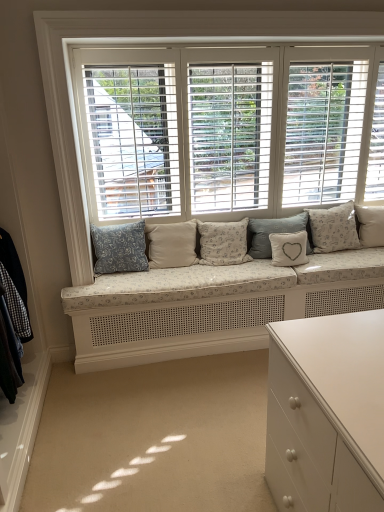
Question: Does white textured cushion at center, the 2th pillow positioned from the right, come in front of white textured pillow at right, which appears as the first pillow when viewed from the right?

Choices:
 (A) no
 (B) yes

Answer: (B)

Question: Does white textured cushion at center, arranged as the sixth pillow when viewed from the left, have a greater width compared to white textured pillow at right, which appears as the first pillow when viewed from the right?

Choices:
 (A) no
 (B) yes

Answer: (B)

Question: Could you tell me if white textured cushion at center, the 2th pillow positioned from the right, is turned towards white textured pillow at right, placed as the seventh pillow when sorted from left to right?

Choices:
 (A) yes
 (B) no

Answer: (B)

Question: Is white textured cushion at center, the 2th pillow positioned from the right, facing away from white textured pillow at right, placed as the seventh pillow when sorted from left to right?

Choices:
 (A) yes
 (B) no

Answer: (B)

Question: Does white textured cushion at center, arranged as the sixth pillow when viewed from the left, have a greater height compared to white textured pillow at right, placed as the seventh pillow when sorted from left to right?

Choices:
 (A) yes
 (B) no

Answer: (A)

Question: Can you see white textured cushion at center, the 2th pillow positioned from the right, touching white textured pillow at right, placed as the seventh pillow when sorted from left to right?

Choices:
 (A) no
 (B) yes

Answer: (A)

Question: Considering the relative sizes of white textured pillow at center, the 5th pillow when ordered from left to right, and white textured pillow at right, placed as the seventh pillow when sorted from left to right, in the image provided, is white textured pillow at center, the 5th pillow when ordered from left to right, shorter than white textured pillow at right, placed as the seventh pillow when sorted from left to right,?

Choices:
 (A) yes
 (B) no

Answer: (A)

Question: Is white textured pillow at center, the 5th pillow when ordered from left to right, positioned in front of white textured pillow at right, placed as the seventh pillow when sorted from left to right?

Choices:
 (A) yes
 (B) no

Answer: (A)

Question: Considering the relative positions of white textured pillow at center, placed as the third pillow when sorted from right to left, and white textured pillow at right, which appears as the first pillow when viewed from the right, in the image provided, is white textured pillow at center, placed as the third pillow when sorted from right to left, behind white textured pillow at right, which appears as the first pillow when viewed from the right,?

Choices:
 (A) yes
 (B) no

Answer: (B)

Question: Would you say white textured pillow at center, placed as the third pillow when sorted from right to left, is a long distance from white textured pillow at right, placed as the seventh pillow when sorted from left to right?

Choices:
 (A) no
 (B) yes

Answer: (A)

Question: Considering the relative sizes of white textured pillow at center, placed as the third pillow when sorted from right to left, and white textured pillow at right, placed as the seventh pillow when sorted from left to right, in the image provided, is white textured pillow at center, placed as the third pillow when sorted from right to left, bigger than white textured pillow at right, placed as the seventh pillow when sorted from left to right,?

Choices:
 (A) yes
 (B) no

Answer: (B)

Question: Is white textured pillow at center, the 5th pillow when ordered from left to right, taller than white textured pillow at right, placed as the seventh pillow when sorted from left to right?

Choices:
 (A) no
 (B) yes

Answer: (A)

Question: Is the depth of white textured cushion at center, arranged as the sixth pillow when viewed from the left, less than that of gray fabric pillow at center, the 4th pillow when ordered from left to right?

Choices:
 (A) no
 (B) yes

Answer: (A)